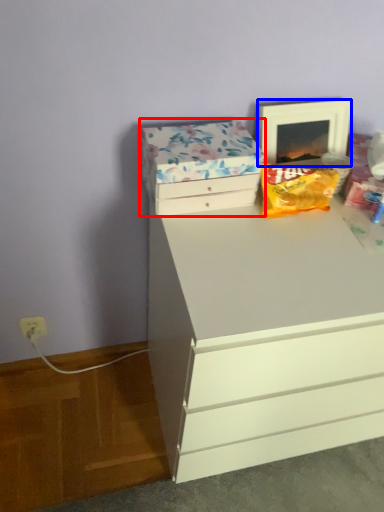
Question: Which point is closer to the camera, storage box (highlighted by a red box) or picture frame (highlighted by a blue box)?

Choices:
 (A) storage box
 (B) picture frame

Answer: (A)